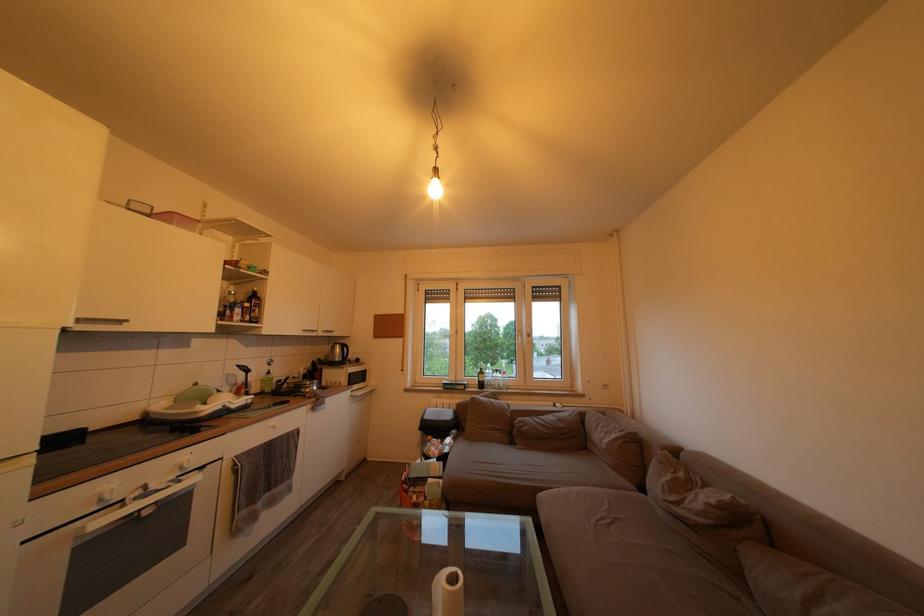
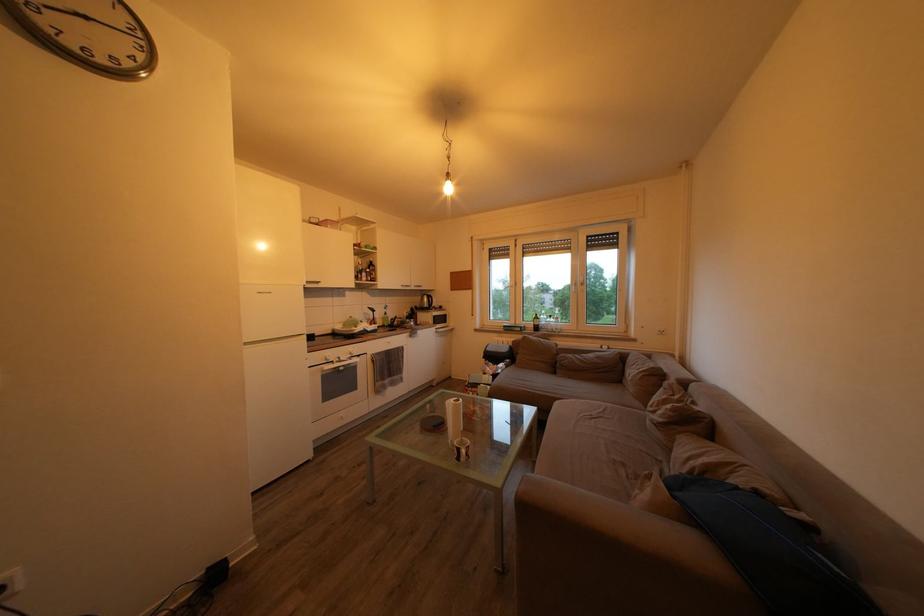
Where in the second image is the point corresponding to point 465,296 from the first image?

(524, 252)